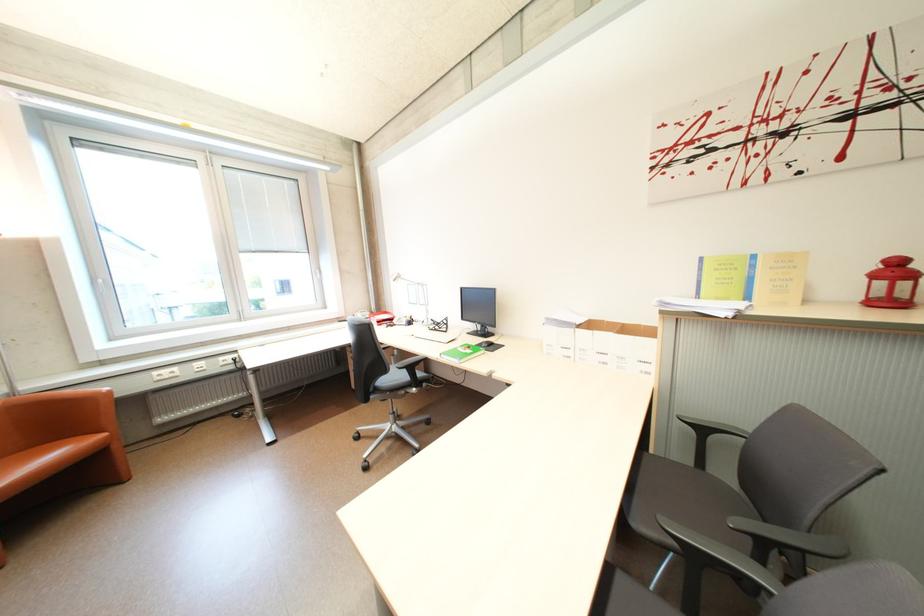
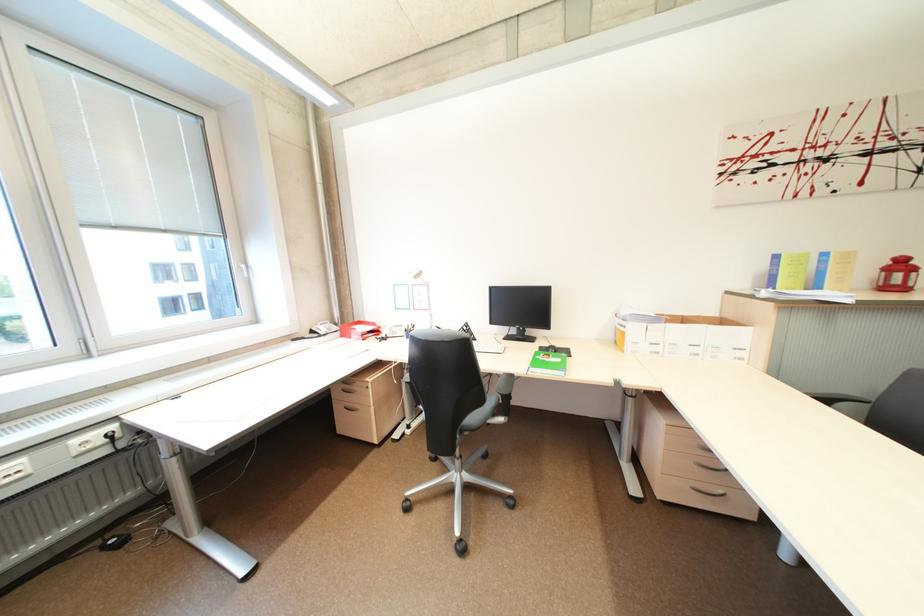
Where in the second image is the point corresponding to pixel 711 261 from the first image?

(785, 257)